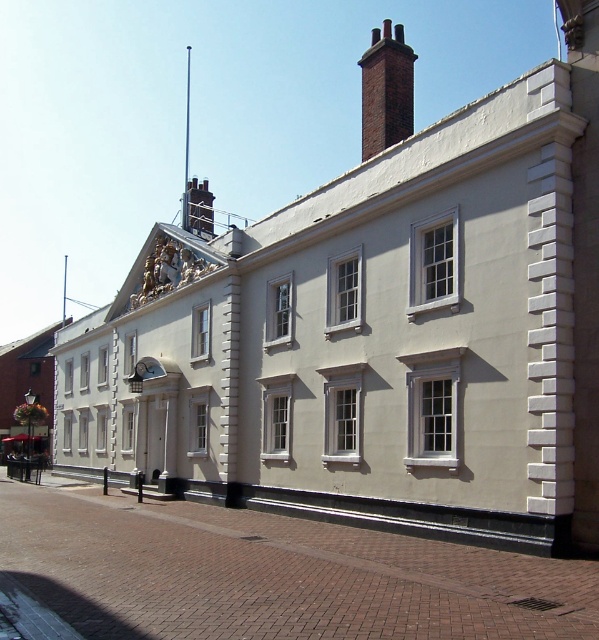
You are an architect standing in front of the two story building. You notice two points marked on the facade. The first point is at coordinate point (365, 116) and the second is at point (141, 362). Which point is closer to you as you face the building?

Point (365, 116) is in front of point (141, 362), so the first point is closer to you.

You are an architect inspecting the building and need to install a new decorative element. The metallic clock at center is currently in place. If you want to replace it with a wider element, would the space where the brick chimney at upper center is located be suitable?

The brick chimney at upper center is wider than the metallic clock at center, so the space where the brick chimney is located can accommodate a wider decorative element than the current clock.